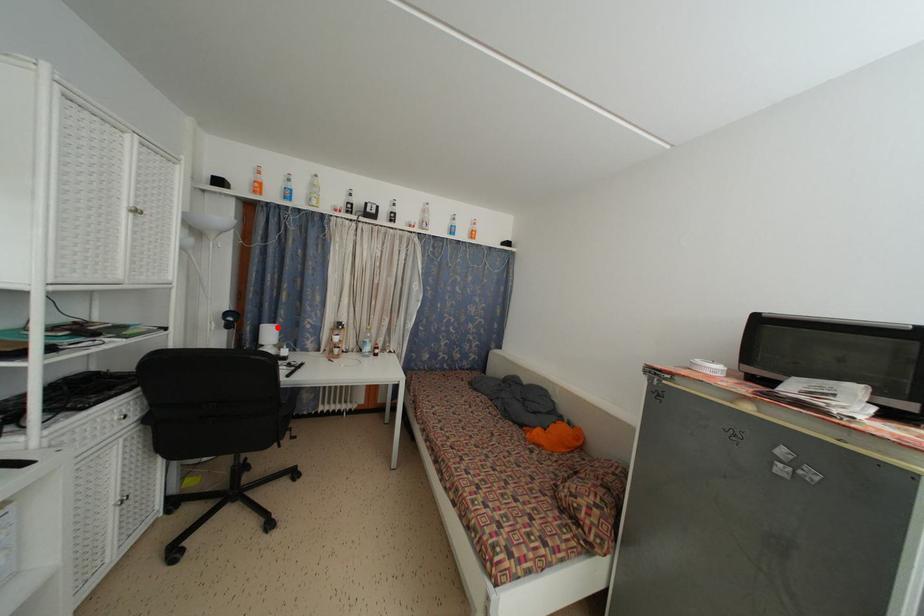
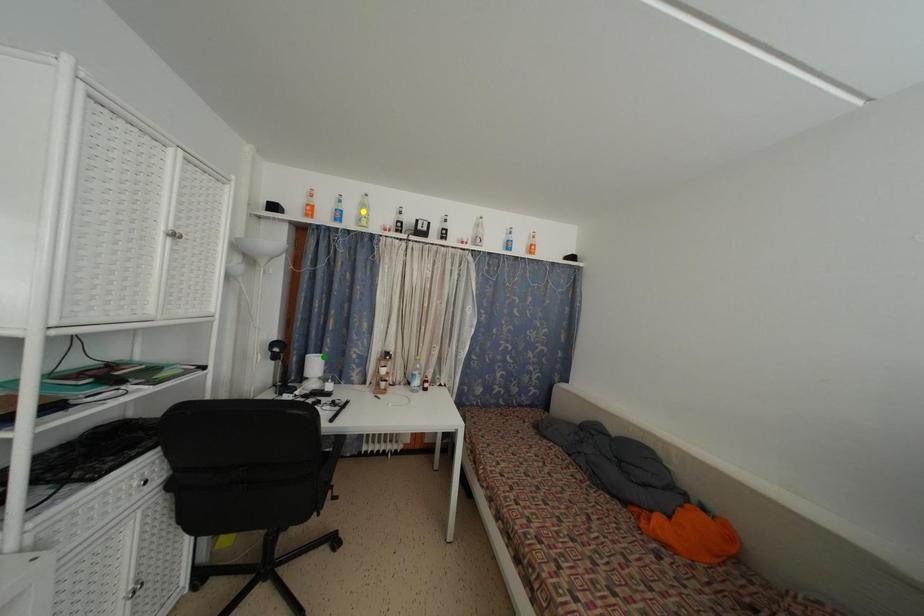
Question: I am providing you with two images of the same scene from different viewpoints. A red point is marked on the first image. You are given multiple points on the second image. Which point in image 2 represents the same 3d spot as the red point in image 1?

Choices:
 (A) blue point
 (B) yellow point
 (C) green point

Answer: (C)